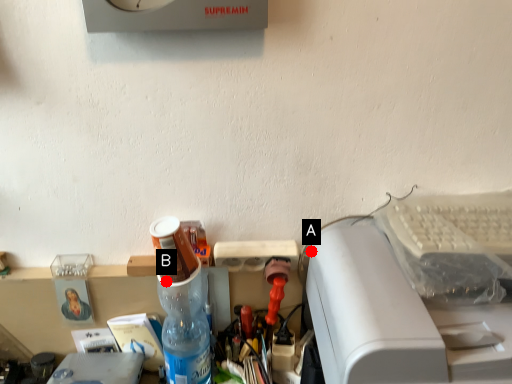
Question: Two points are circled on the image, labeled by A and B beside each circle. Which point is farther from the camera taking this photo?

Choices:
 (A) A is further
 (B) B is further

Answer: (A)